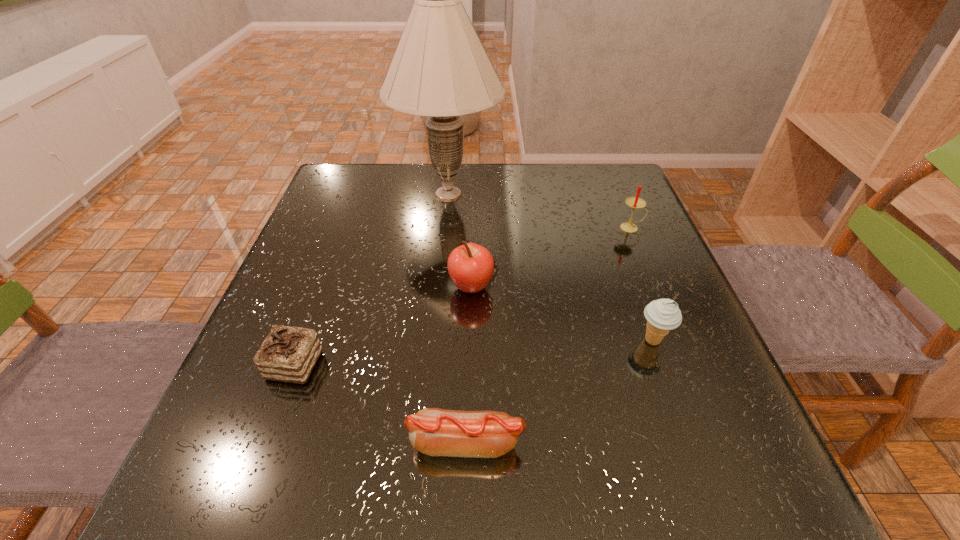
Identify the location of lampshade. This screenshot has height=540, width=960. (440, 69).

Locate an element on the screen. The image size is (960, 540). candle is located at coordinates [634, 202].

Where is `the third farthest object`? the third farthest object is located at coordinates (470, 266).

This screenshot has height=540, width=960. Identify the location of icecream. (662, 315).

The image size is (960, 540). Identify the location of chocolate cake. (288, 354).

Identify the location of sausage. (435, 432).

I want to click on vacant space located 0.200m on the front of the tallest object, so [x=440, y=281].

Where is `free space located on the back of the candle`? free space located on the back of the candle is located at coordinates (620, 200).

You are a GUI agent. You are given a task and a screenshot of the screen. Output one action in this format:
    pyautogui.click(x=<x>, y=<y>)
    Task: Click on the vacant space located on the front of the fourth nearest object
    
    Given the screenshot: What is the action you would take?
    pyautogui.click(x=469, y=345)

Locate an element on the screen. The height and width of the screenshot is (540, 960). vacant space situated 0.110m on the left of the icecream is located at coordinates (578, 341).